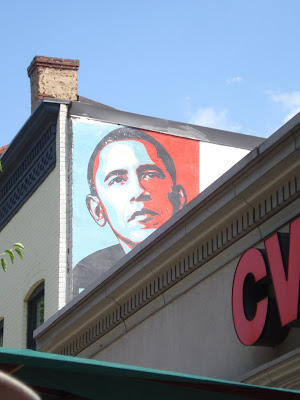
I want to click on brick chimney, so click(64, 85).